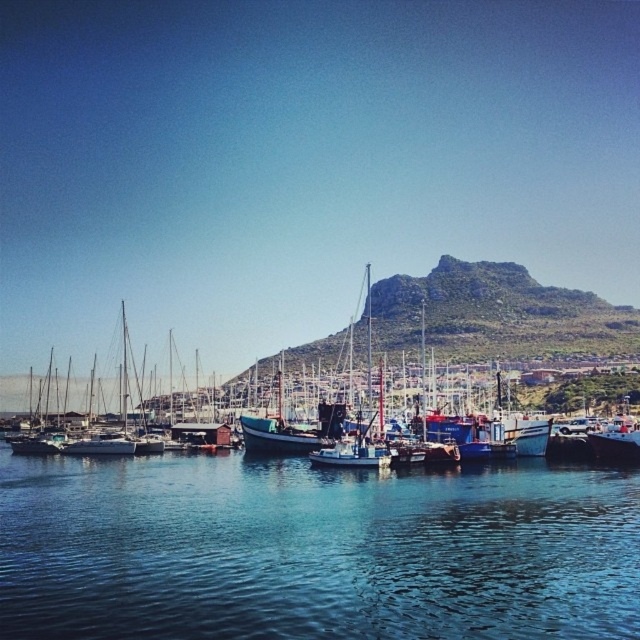
You are standing at the edge of the harbor looking out. Based on the coordinates provided, where would you see the blue water at center in relation to your viewpoint?

The blue water at center is located at coordinates point (314, 550), which places it slightly to the right and near the center vertically from your viewpoint.

You are standing at the point marked by the coordinates point (314, 550) in the harbor scene. Based on the image description, what is the immediate surface beneath your feet?

The point (314, 550) is on blue water at center, so the immediate surface beneath your feet would be the blue water at center.

You are standing at the edge of the harbor looking out. Which object is closer to you, the blue water at center or the rugged stone mountain at upper center?

The blue water at center is closer to the viewer than the rugged stone mountain at upper center.